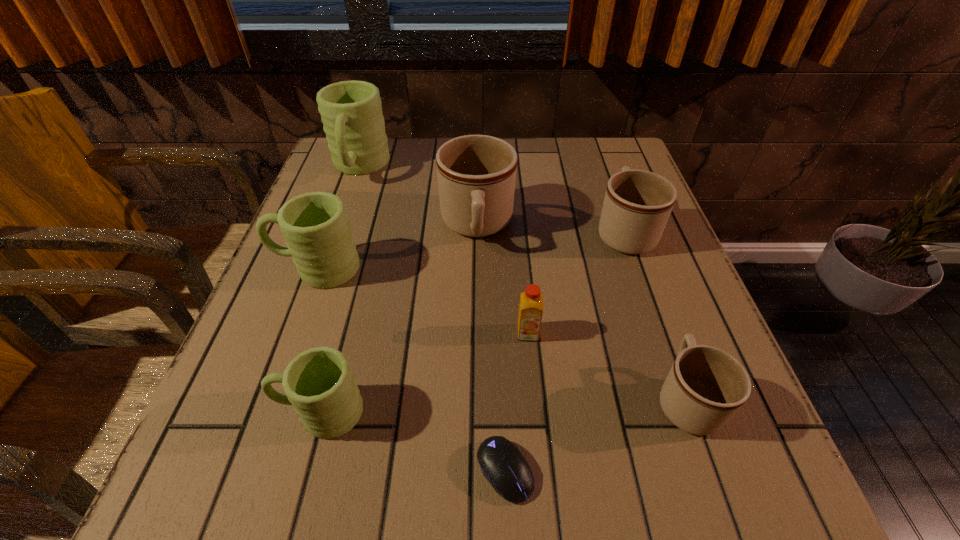
In order to click on free spot located on the side of the nearest brown mug with the handle in this screenshot , I will do `click(646, 286)`.

Where is `vacant space located on the side of the nearest brown mug with the handle`? This screenshot has width=960, height=540. vacant space located on the side of the nearest brown mug with the handle is located at coordinates (631, 242).

This screenshot has width=960, height=540. I want to click on vacant point located 0.150m on the right of the shortest object, so click(638, 471).

The width and height of the screenshot is (960, 540). In order to click on object that is at the far edge in this screenshot , I will do `click(351, 111)`.

Identify the location of object present at the near edge. Image resolution: width=960 pixels, height=540 pixels. (502, 463).

You are a GUI agent. You are given a task and a screenshot of the screen. Output one action in this format:
    pyautogui.click(x=<x>, y=<y>)
    Task: Click on the object that is at the far left corner
    
    Given the screenshot: What is the action you would take?
    pyautogui.click(x=351, y=111)

Where is `vacant space at the far edge of the desktop`? This screenshot has height=540, width=960. vacant space at the far edge of the desktop is located at coordinates (536, 141).

The width and height of the screenshot is (960, 540). I want to click on vacant space at the near edge of the desktop, so click(x=315, y=512).

This screenshot has height=540, width=960. Find the location of `free space at the left edge of the desktop`. free space at the left edge of the desktop is located at coordinates (254, 343).

What are the coordinates of `blank space at the right edge of the desktop` in the screenshot? It's located at (756, 445).